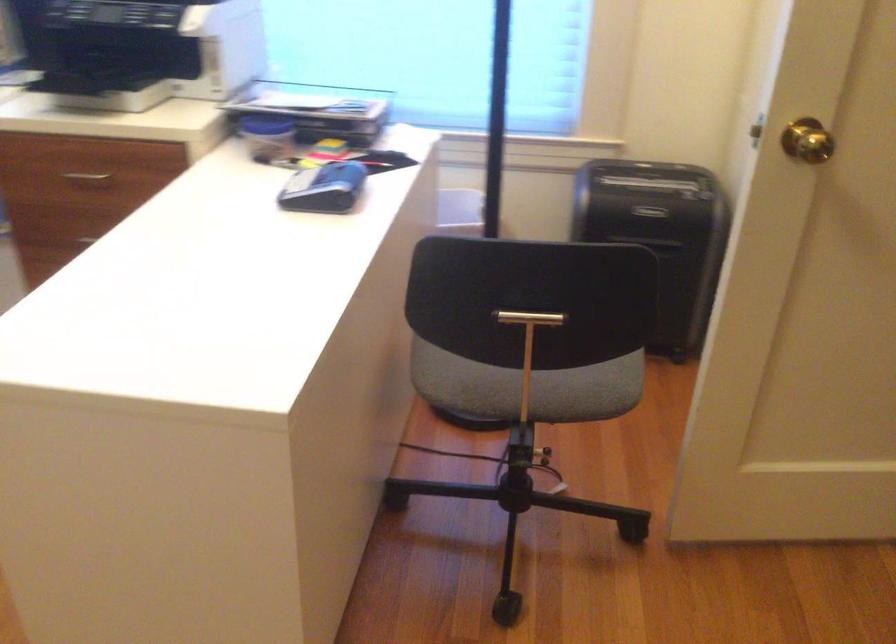
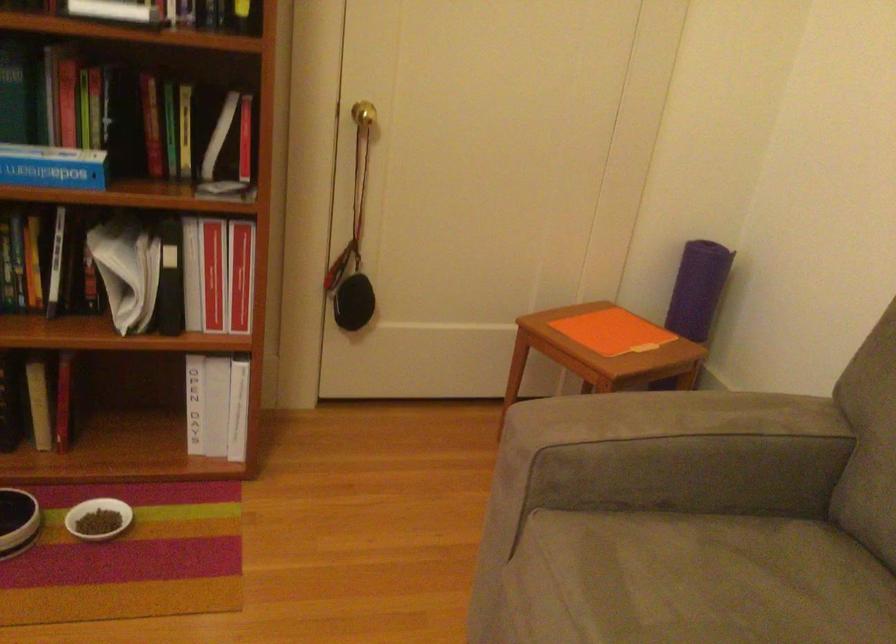
How did the camera likely rotate?

The camera's rotation is toward right-down.